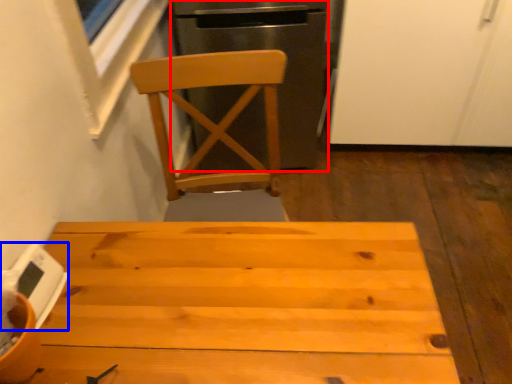
Question: Which object is further to the camera taking this photo, leftover (highlighted by a red box) or appliance (highlighted by a blue box)?

Choices:
 (A) leftover
 (B) appliance

Answer: (A)